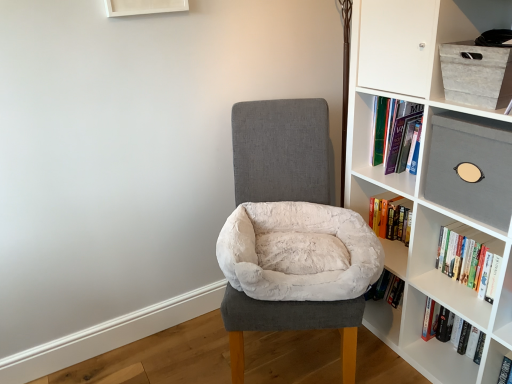
Locate an element on the screen. The image size is (512, 384). white plush pet bed at center is located at coordinates (283, 151).

The height and width of the screenshot is (384, 512). In order to click on matte gray box at upper right in this screenshot , I will do `click(472, 163)`.

Measure the distance between white matte bookcase at right and camera.

The distance of white matte bookcase at right from camera is 1.19 meters.

What do you see at coordinates (468, 262) in the screenshot?
I see `hardcover book at right, the 2th book from the bottom` at bounding box center [468, 262].

At what (x,y) coordinates should I click in order to perform the action: click on white plush bean bag at center. Please return your answer as a coordinate pair (x, y). Image resolution: width=512 pixels, height=384 pixels. Looking at the image, I should click on (298, 252).

Considering the sizes of objects white matte bookcase at right and hardcover book at right, the second book positioned from the top, in the image provided, who is smaller, white matte bookcase at right or hardcover book at right, the second book positioned from the top,?

Smaller between the two is hardcover book at right, the second book positioned from the top.

Considering the relative sizes of white matte bookcase at right and hardcover book at right, the second book positioned from the top, in the image provided, is white matte bookcase at right thinner than hardcover book at right, the second book positioned from the top,?

Incorrect, the width of white matte bookcase at right is not less than that of hardcover book at right, the second book positioned from the top.

From the image's perspective, between white matte bookcase at right and hardcover book at right, the second book positioned from the top, who is located below?

From the image's view, hardcover book at right, the second book positioned from the top, is below.

From a real-world perspective, which object stands above the other?

From a 3D spatial view, white matte bookcase at right is above.

Is hardcover book at right, which is the 1th book in bottom-to-top order, facing towards matte gray box at upper right?

No, hardcover book at right, which is the 1th book in bottom-to-top order, is not oriented towards matte gray box at upper right.

Looking at this image, from the image's perspective, does hardcover book at right, the second book positioned from the top, appear higher than matte gray box at upper right?

No, from the image's perspective, hardcover book at right, the second book positioned from the top, is not over matte gray box at upper right.

How many degrees apart are the facing directions of hardcover book at right, the second book positioned from the top, and matte gray box at upper right?

The angle between the facing direction of hardcover book at right, the second book positioned from the top, and the facing direction of matte gray box at upper right is 3.48 degrees.

Relative to matte gray box at upper right, is hardcover book at right, which is the 1th book in bottom-to-top order, in front or behind?

hardcover book at right, which is the 1th book in bottom-to-top order, is behind matte gray box at upper right.

Is white textured box at upper right surrounded by hardcover book at right, the 2th book from the bottom?

No.

Which object is thinner, hardcover book at right, arranged as the first book when viewed from the top, or white textured box at upper right?

Thinner between the two is hardcover book at right, arranged as the first book when viewed from the top.

From a real-world perspective, is hardcover book at right, arranged as the first book when viewed from the top, on top of white textured box at upper right?

No.

Is point (475, 348) behind point (346, 308)?

Yes, it is behind point (346, 308).

Could you tell me if hardcover book at right, the second book positioned from the top, is facing white plush pet bed at center?

No.

Does hardcover book at right, the second book positioned from the top, come behind white plush pet bed at center?

Yes, the depth of hardcover book at right, the second book positioned from the top, is greater than that of white plush pet bed at center.

Is hardcover book at right, the 2th book from the bottom, bigger than white plush bean bag at center?

No, hardcover book at right, the 2th book from the bottom, is not bigger than white plush bean bag at center.

Is point (496, 282) more distant than point (277, 221)?

No, (496, 282) is closer to viewer.

From the image's perspective, between hardcover book at right, the 2th book from the bottom, and white plush bean bag at center, who is located below?

hardcover book at right, the 2th book from the bottom, appears lower in the image.

Between hardcover book at right, the 2th book from the bottom, and white plush bean bag at center, which one is positioned in front?

white plush bean bag at center is closer to the camera.

You are a GUI agent. You are given a task and a screenshot of the screen. Output one action in this format:
    pyautogui.click(x=<x>, y=<y>)
    Task: Click on the 1st book behind the white plush pet bed at center
    The width and height of the screenshot is (512, 384).
    Given the screenshot: What is the action you would take?
    pyautogui.click(x=468, y=262)

Does white plush pet bed at center have a larger size compared to hardcover book at right, arranged as the first book when viewed from the top?

Yes.

Which object is further away from the camera, white plush pet bed at center or hardcover book at right, arranged as the first book when viewed from the top?

hardcover book at right, arranged as the first book when viewed from the top, is behind.

Would you say white plush pet bed at center is inside or outside hardcover book at right, arranged as the first book when viewed from the top?

white plush pet bed at center exists outside the volume of hardcover book at right, arranged as the first book when viewed from the top.

Between matte gray box at upper right and white textured box at upper right, which one has more height?

Standing taller between the two is matte gray box at upper right.

Does matte gray box at upper right appear on the left side of white textured box at upper right?

No, matte gray box at upper right is not to the left of white textured box at upper right.

Based on their sizes in the image, would you say matte gray box at upper right is bigger or smaller than white textured box at upper right?

matte gray box at upper right is bigger than white textured box at upper right.

Which is nearer, (x=509, y=205) or (x=484, y=63)?

The point (x=484, y=63) is more forward.

Where is `the 2nd book behind the white matte bookcase at right, starting your count from the anchor`? The height and width of the screenshot is (384, 512). the 2nd book behind the white matte bookcase at right, starting your count from the anchor is located at coordinates (449, 329).

Starting from the matte gray box at upper right, which book is the 2nd one to the right? Please provide its 2D coordinates.

[(449, 329)]

Considering their positions, is white plush pet bed at center positioned further to hardcover book at right, arranged as the first book when viewed from the top, than white matte bookcase at right?

Based on the image, white plush pet bed at center appears to be further to hardcover book at right, arranged as the first book when viewed from the top.

Looking at the image, which one is located closer to hardcover book at right, arranged as the first book when viewed from the top, white plush pet bed at center or hardcover book at right, which is the 1th book in bottom-to-top order?

hardcover book at right, which is the 1th book in bottom-to-top order, lies closer to hardcover book at right, arranged as the first book when viewed from the top, than the other object.

Looking at the image, which one is located further to hardcover book at right, the 2th book from the bottom, hardcover book at right, which is the 1th book in bottom-to-top order, or white textured box at upper right?

Based on the image, white textured box at upper right appears to be further to hardcover book at right, the 2th book from the bottom.

Which object lies nearer to the anchor point white textured box at upper right, hardcover book at right, arranged as the first book when viewed from the top, or white plush pet bed at center?

hardcover book at right, arranged as the first book when viewed from the top, is closer to white textured box at upper right.

Considering their positions, is white plush pet bed at center positioned closer to hardcover book at right, which is the 1th book in bottom-to-top order, than matte gray box at upper right?

matte gray box at upper right lies closer to hardcover book at right, which is the 1th book in bottom-to-top order, than the other object.

Based on their spatial positions, is white textured box at upper right or matte gray box at upper right further from hardcover book at right, arranged as the first book when viewed from the top?

The object further to hardcover book at right, arranged as the first book when viewed from the top, is white textured box at upper right.

Looking at the image, which one is located further to white textured box at upper right, hardcover book at right, the second book positioned from the top, or white plush pet bed at center?

The object further to white textured box at upper right is hardcover book at right, the second book positioned from the top.

Estimate the real-world distances between objects in this image. Which object is closer to white plush bean bag at center, hardcover book at right, the second book positioned from the top, or matte gray box at upper right?

matte gray box at upper right.

I want to click on bean bag chair located between white plush pet bed at center and white matte bookcase at right in the left-right direction, so click(x=298, y=252).

Identify the location of bookcase situated between white plush pet bed at center and hardcover book at right, the 2th book from the bottom, from left to right. (420, 184).

Locate an element on the screen. bookcase located between white plush bean bag at center and hardcover book at right, arranged as the first book when viewed from the top, in the left-right direction is located at coordinates (420, 184).

Find the location of a particular element. bookcase that lies between matte gray box at upper right and hardcover book at right, which is the 1th book in bottom-to-top order, from top to bottom is located at coordinates (420, 184).